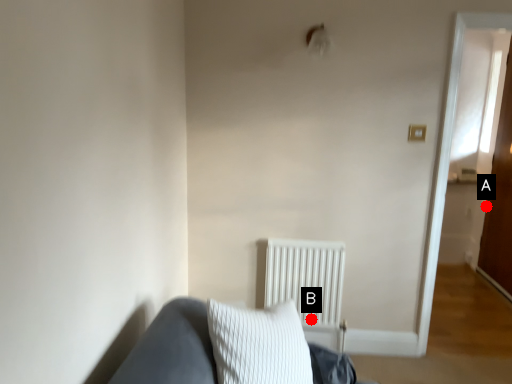
Question: Two points are circled on the image, labeled by A and B beside each circle. Which point is closer to the camera?

Choices:
 (A) A is closer
 (B) B is closer

Answer: (B)